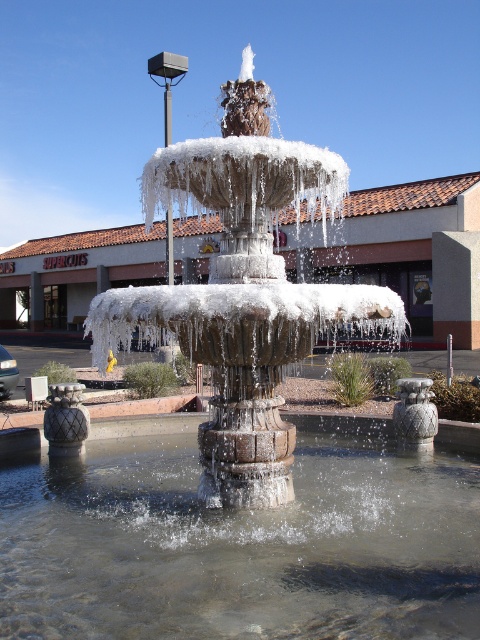
Is the position of icy stone fountain at center more distant than that of white ice fountain at center?

No.

Is icy stone fountain at center bigger than white ice fountain at center?

No.

The height and width of the screenshot is (640, 480). Identify the location of icy stone fountain at center. (242, 289).

The width and height of the screenshot is (480, 640). Describe the element at coordinates (240, 541) in the screenshot. I see `clear water at center` at that location.

Is clear water at center below white ice fountain at center?

Yes.

I want to click on clear water at center, so click(240, 541).

Who is positioned more to the right, clear water at center or icy stone fountain at center?

From the viewer's perspective, clear water at center appears more on the right side.

Who is lower down, clear water at center or icy stone fountain at center?

clear water at center

This screenshot has height=640, width=480. What do you see at coordinates (240, 541) in the screenshot?
I see `clear water at center` at bounding box center [240, 541].

The image size is (480, 640). I want to click on clear water at center, so click(240, 541).